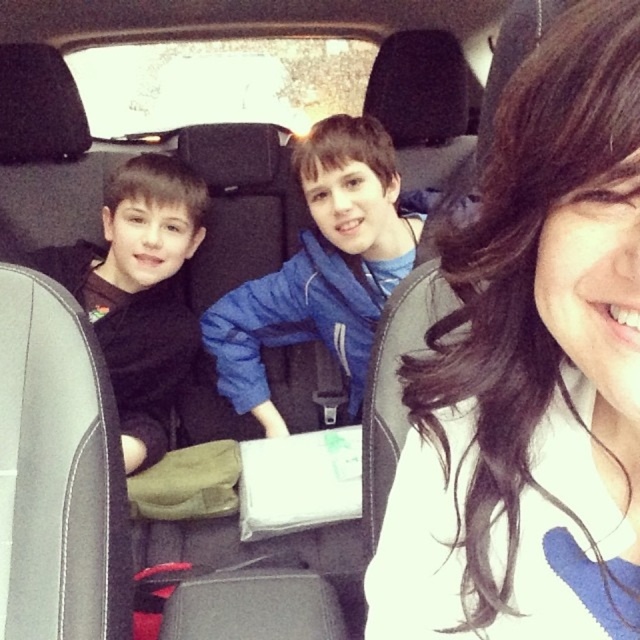
You are a tailor measuring jackets for alterations. You need to determine which jacket requires a shorter length adjustment. Which one is shorter between the blue fleece jacket at center and the black matte jacket at left?

The black matte jacket at left is shorter than the blue fleece jacket at center, so it requires a shorter length adjustment.

You are a delivery person who needs to place a small package between the smooth brown hair at center and the blue fleece jacket at center. Can you fit the package in that space if it measures 1 meter in length?

The smooth brown hair at center and blue fleece jacket at center are 1.04 meters apart, so yes, the package measuring 1 meter in length can fit between them as there is enough space.

You are sitting in the backseat of the car and want to hand a toy to the person sitting in front of you. The toy is at point (236, 369) and the person is at point (116, 285). Can you reach them directly without moving around?

Point (236, 369) is behind point (116, 285), so you cannot reach them directly without moving around because the toy is located behind the person.